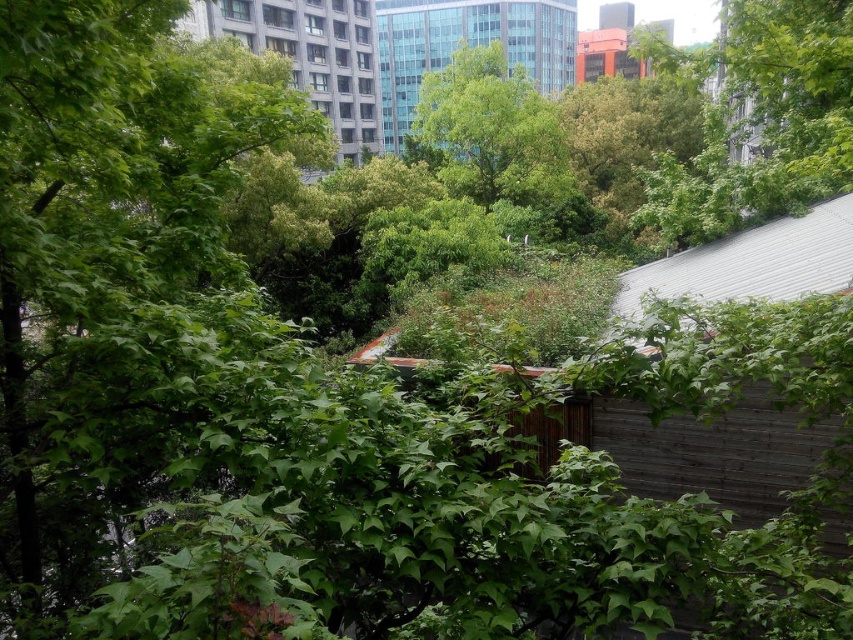
You are standing on the rooftop garden and see two points marked in the image. The first point is at coordinates point [476,40] and the second is at point [195,19]. Which point is closer to you?

Point [476,40] is closer to you because it is further to the viewer than point [195,19].